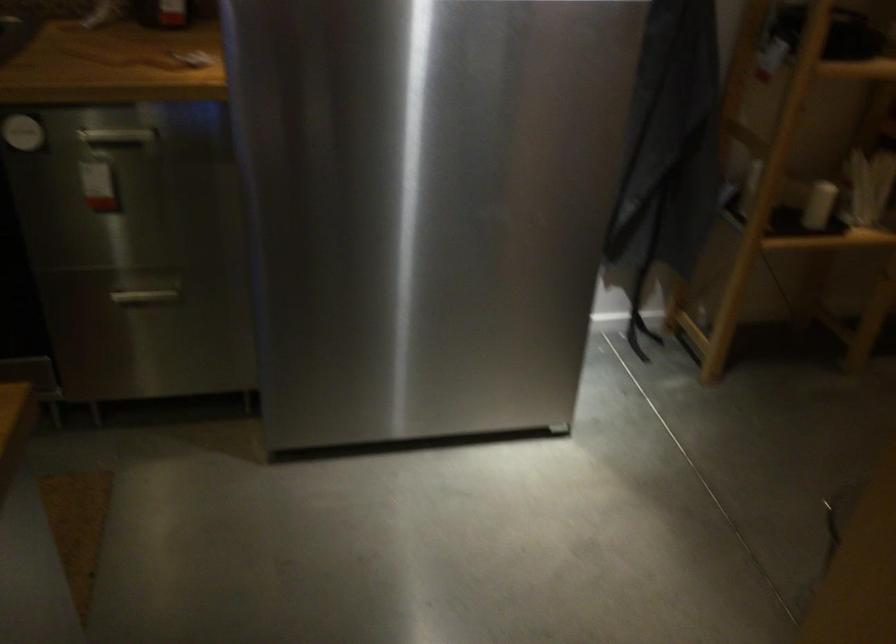
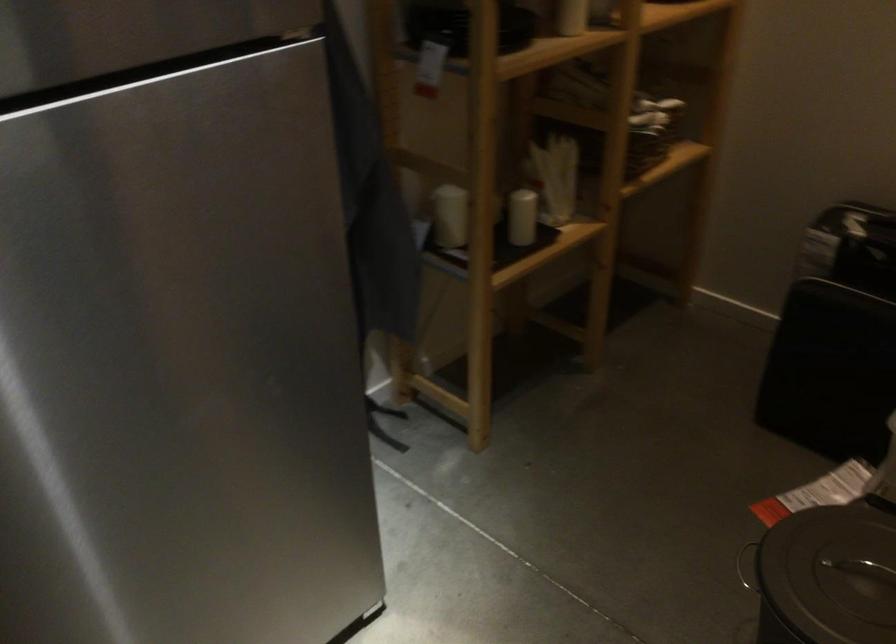
Find the pixel in the second image that matches [756,176] in the first image.

(450, 216)